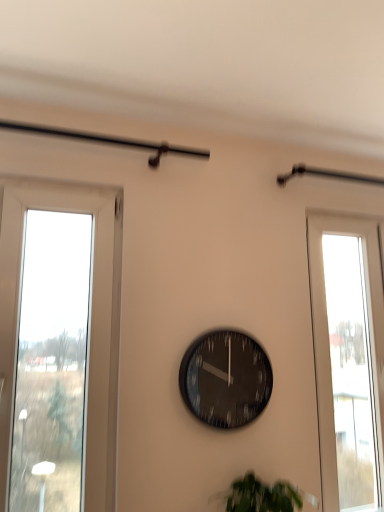
Question: In terms of width, does green leafy plant at lower center look wider or thinner when compared to black glass clock at center?

Choices:
 (A) wide
 (B) thin

Answer: (A)

Question: Which is correct: green leafy plant at lower center is inside black glass clock at center, or outside of it?

Choices:
 (A) outside
 (B) inside

Answer: (A)

Question: Estimate the real-world distances between objects in this image. Which object is farther from the transparent glass window at right?

Choices:
 (A) green leafy plant at lower center
 (B) black glass clock at center

Answer: (A)

Question: Considering the real-world distances, which object is farthest from the black glass clock at center?

Choices:
 (A) transparent glass window at right
 (B) green leafy plant at lower center

Answer: (A)